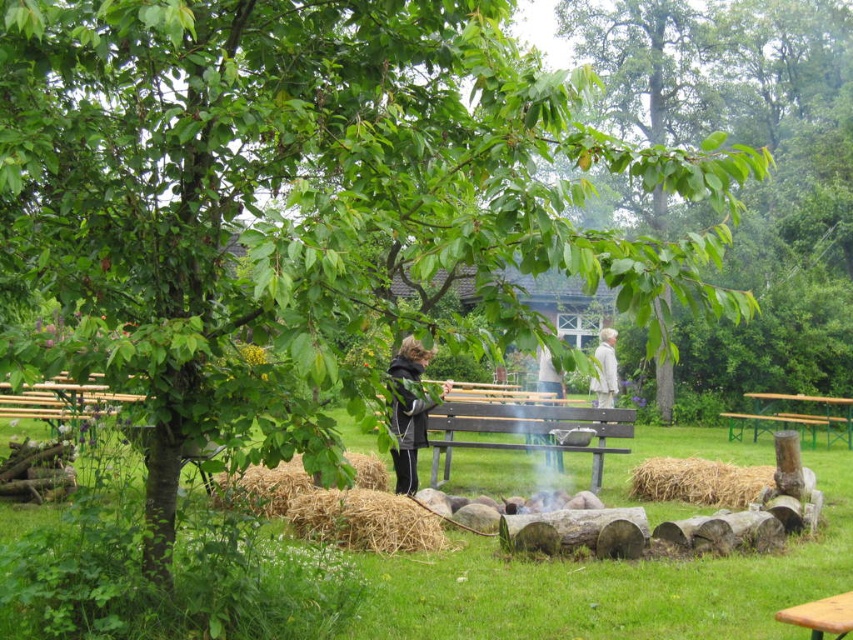
Is brown straw bale at center to the left of white cotton shirt at center from the viewer's perspective?

Incorrect, brown straw bale at center is not on the left side of white cotton shirt at center.

Can you confirm if brown straw bale at center is positioned below white cotton shirt at center?

Indeed, brown straw bale at center is positioned under white cotton shirt at center.

This screenshot has height=640, width=853. Describe the element at coordinates (699, 481) in the screenshot. I see `brown straw bale at center` at that location.

The width and height of the screenshot is (853, 640). I want to click on brown straw bale at center, so click(699, 481).

Can you confirm if green leafy tree at upper center is shorter than white cotton shirt at center?

No.

From the picture: Who is more distant from viewer, [758,196] or [550,368]?

Point [758,196]

Find the location of a particular element. green leafy tree at upper center is located at coordinates (753, 145).

Who is taller, wooden bench at lower right or white fabric coat at center?

Standing taller between the two is white fabric coat at center.

Can you confirm if wooden bench at lower right is taller than white fabric coat at center?

Incorrect, wooden bench at lower right's height is not larger of white fabric coat at center's.

What do you see at coordinates (821, 616) in the screenshot? I see `wooden bench at lower right` at bounding box center [821, 616].

Identify the location of wooden bench at lower right. (821, 616).